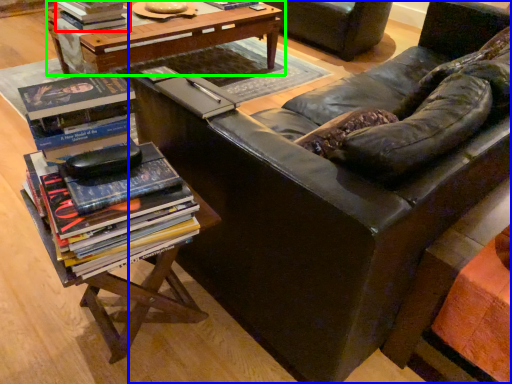
Question: Based on their relative distances, which object is nearer to book (highlighted by a red box)? Choose from studio couch (highlighted by a blue box) and table (highlighted by a green box).

Choices:
 (A) studio couch
 (B) table

Answer: (B)